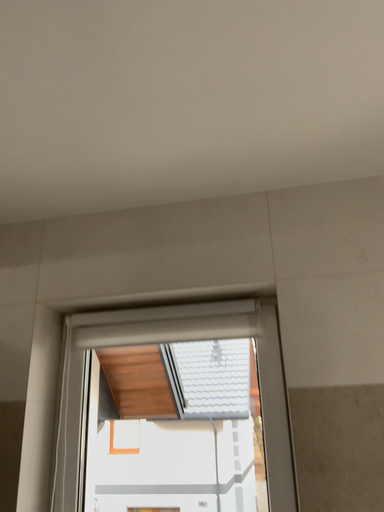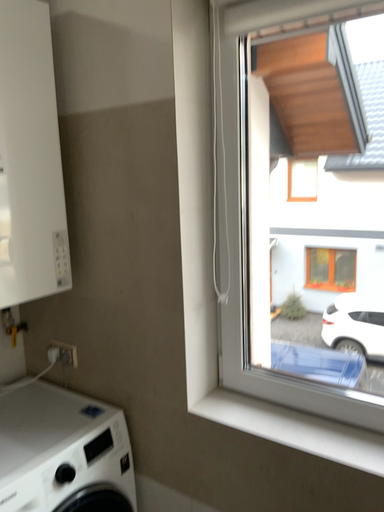
Question: How did the camera likely rotate when shooting the video?

Choices:
 (A) rotated left
 (B) rotated right

Answer: (A)